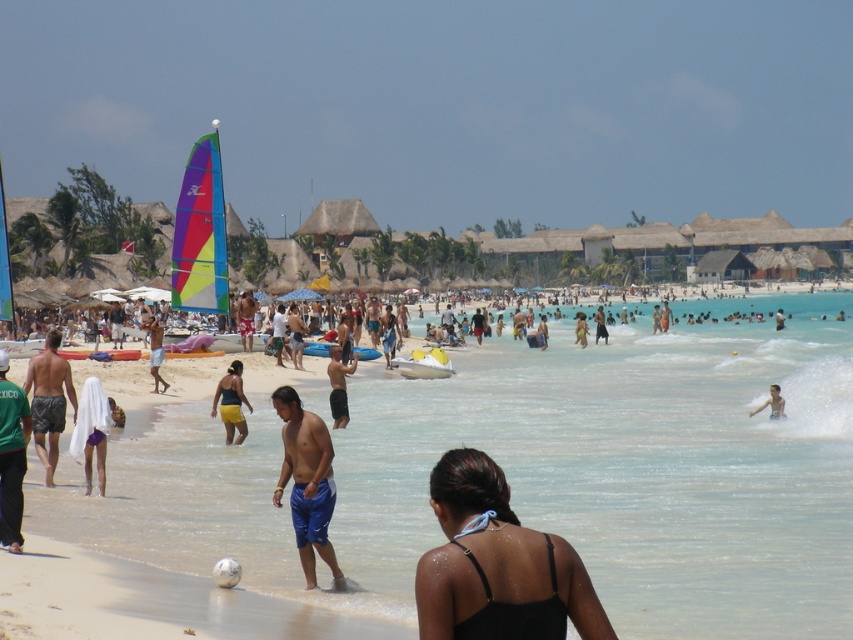
You are standing on the beach and want to hand a towel to both the person wearing the green fabric shirt at lower left and the person wearing dark blue shorts at center. Which person should you approach first to reach them more quickly?

You should approach the person wearing the green fabric shirt at lower left first because they are closer to you than the dark blue shorts at center, so you can reach them more quickly.

You are standing at the location of the camera and want to retrieve the matte yellow shorts at center. Can you walk directly to them without needing to swim?

The matte yellow shorts at center and camera are 46.05 meters apart from each other, so yes, you can walk directly to them without needing to swim as the distance is manageable on land.